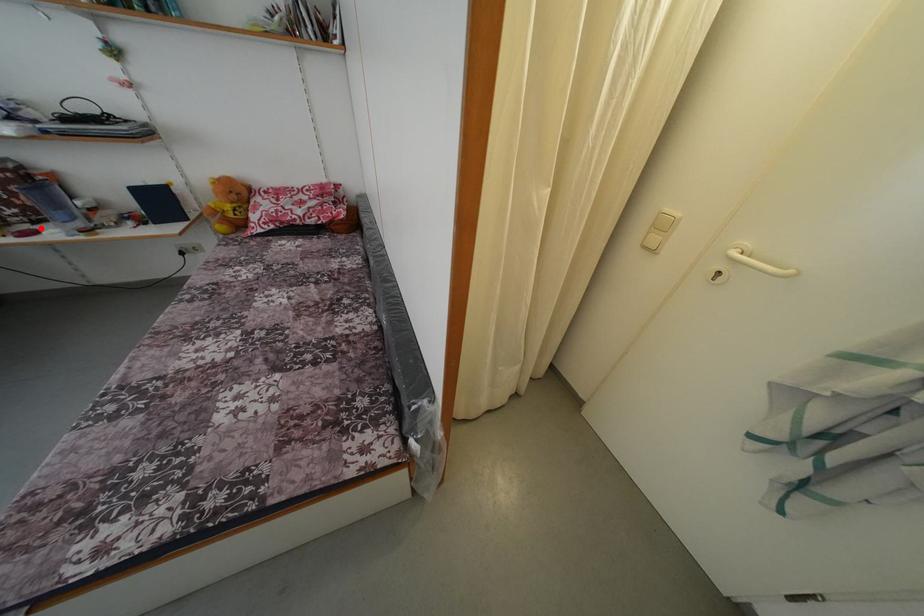
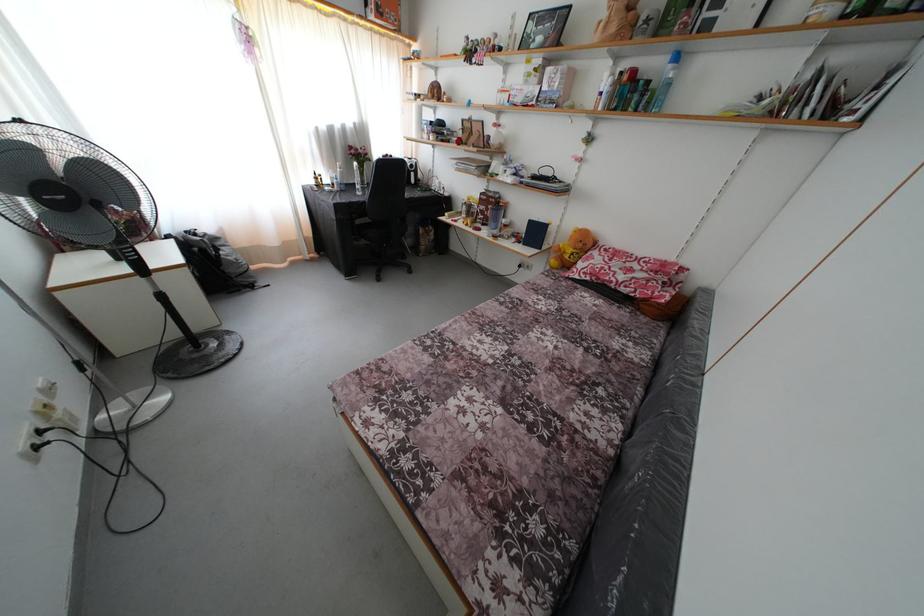
Question: I am providing you with two images of the same scene from different viewpoints. A red point is shown in image1. For the corresponding object point in image2, is it positioned nearer or farther from the camera?

Choices:
 (A) Nearer
 (B) Farther

Answer: (A)